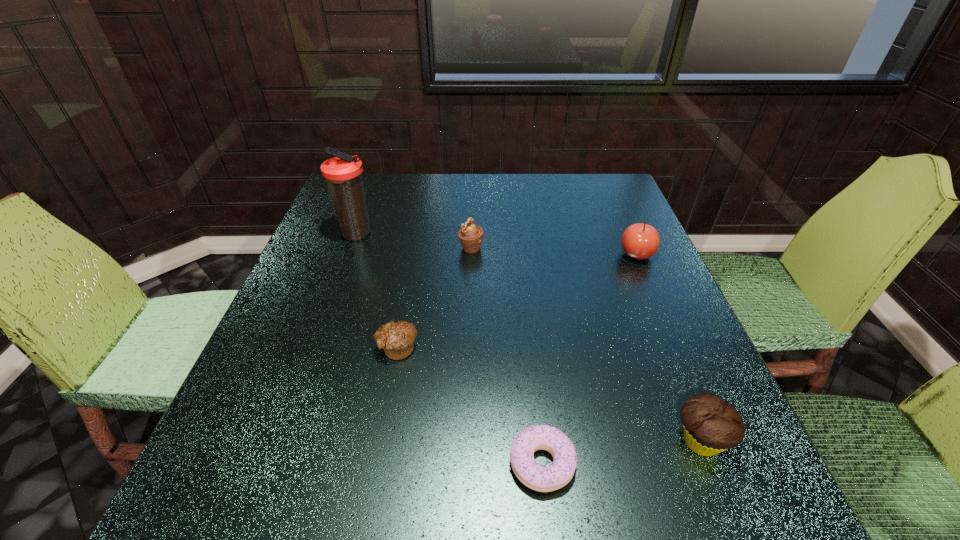
Where is `unoccupied position between the apple and the fourth farthest object`? The height and width of the screenshot is (540, 960). unoccupied position between the apple and the fourth farthest object is located at coordinates (517, 301).

The image size is (960, 540). What are the coordinates of `vacant space in between the farthest muffin and the second nearest muffin` in the screenshot? It's located at pyautogui.click(x=434, y=298).

Find the location of `free spot between the nearest muffin and the second muffin from left to right`. free spot between the nearest muffin and the second muffin from left to right is located at coordinates (586, 345).

This screenshot has height=540, width=960. In order to click on empty space that is in between the apple and the tallest object in this screenshot , I will do pyautogui.click(x=496, y=245).

Find the location of a particular element. The height and width of the screenshot is (540, 960). empty space that is in between the tallest object and the apple is located at coordinates (496, 245).

The width and height of the screenshot is (960, 540). Identify the location of object that is the second closest one to the apple. (710, 426).

Locate which object ranks fifth in proximity to the shortest muffin. Please provide its 2D coordinates. Your answer should be formatted as a tuple, i.e. [(x, y)], where the tuple contains the x and y coordinates of a point satisfying the conditions above.

[(640, 241)]

Locate which muffin ranks second in proximity to the shortest muffin. Please provide its 2D coordinates. Your answer should be formatted as a tuple, i.e. [(x, y)], where the tuple contains the x and y coordinates of a point satisfying the conditions above.

[(710, 426)]

I want to click on muffin that is the nearest to the leftmost muffin, so click(470, 235).

Locate an element on the screen. The width and height of the screenshot is (960, 540). free location that satisfies the following two spatial constraints: 1. on the back side of the farthest muffin; 2. on the right side of the third nearest object is located at coordinates pyautogui.click(x=416, y=248).